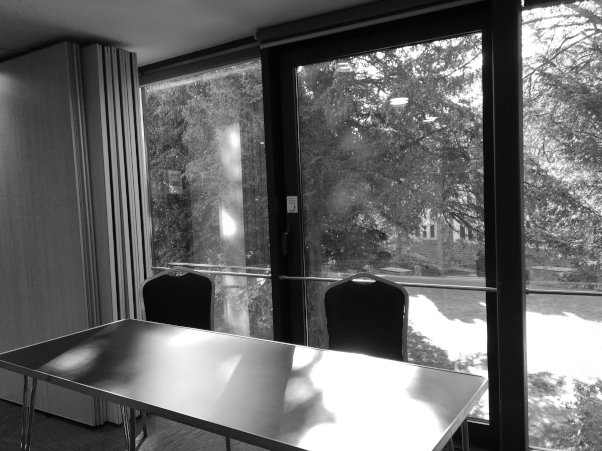
Find the location of a particular element. The image size is (602, 451). middle bottom window glass is located at coordinates [x=445, y=300].